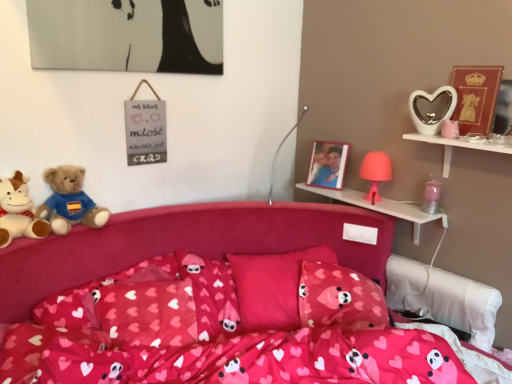
This screenshot has width=512, height=384. What do you see at coordinates (450, 129) in the screenshot?
I see `white glossy heart at upper right, which is the second toy in top-to-bottom order` at bounding box center [450, 129].

The image size is (512, 384). Describe the element at coordinates (455, 146) in the screenshot. I see `white glossy heart-shaped object at upper right, which ranks as the 2th shelf in back-to-front order` at that location.

At what (x,y) coordinates should I click in order to perform the action: click on white glossy heart-shaped object at upper right, marked as the first shelf in a front-to-back arrangement. Please return your answer as a coordinate pair (x, y). Looking at the image, I should click on (455, 146).

At what (x,y) coordinates should I click in order to perform the action: click on matte gold picture frame at upper right, arranged as the 2th picture frame when viewed from the left. Please return your answer as a coordinate pair (x, y). Image resolution: width=512 pixels, height=384 pixels. Looking at the image, I should click on (476, 97).

How much space does pink fabric pillow at center, placed as the first pillow when sorted from right to left, occupy vertically?

18.28 centimeters.

Describe the element at coordinates (328, 164) in the screenshot. Image resolution: width=512 pixels, height=384 pixels. I see `wooden photo frame at upper right, the 2th picture frame viewed from the right` at that location.

Where is `white glossy heart at upper right, the 3th toy ordered from the bottom`? This screenshot has height=384, width=512. white glossy heart at upper right, the 3th toy ordered from the bottom is located at coordinates (450, 129).

Between matte pink lamp at upper right, placed as the third toy when sorted from top to bottom, and silver metallic lamp at center, which one is positioned in front?

silver metallic lamp at center is more forward.

Which of these two, matte pink lamp at upper right, which is counted as the second toy, starting from the bottom, or silver metallic lamp at center, stands shorter?

matte pink lamp at upper right, which is counted as the second toy, starting from the bottom.

From the image's perspective, between matte pink lamp at upper right, placed as the third toy when sorted from top to bottom, and silver metallic lamp at center, who is located below?

matte pink lamp at upper right, placed as the third toy when sorted from top to bottom, appears lower in the image.

Considering the relative positions of matte pink lamp at upper right, which is counted as the second toy, starting from the bottom, and silver metallic lamp at center in the image provided, is matte pink lamp at upper right, which is counted as the second toy, starting from the bottom, to the left or to the right of silver metallic lamp at center?

Based on their positions, matte pink lamp at upper right, which is counted as the second toy, starting from the bottom, is located to the right of silver metallic lamp at center.

Considering the relative sizes of matte gold picture frame at upper right, which is counted as the first picture frame, starting from the front, and soft plush teddy bear at left, which is counted as the second teddy bear, starting from the right, in the image provided, is matte gold picture frame at upper right, which is counted as the first picture frame, starting from the front, wider than soft plush teddy bear at left, which is counted as the second teddy bear, starting from the right,?

No.

Is matte gold picture frame at upper right, which is counted as the first picture frame, starting from the front, turned away from soft plush teddy bear at left, the first teddy bear when ordered from left to right?

No, matte gold picture frame at upper right, which is counted as the first picture frame, starting from the front, is not facing the opposite direction of soft plush teddy bear at left, the first teddy bear when ordered from left to right.

In terms of height, does matte gold picture frame at upper right, arranged as the 2th picture frame when viewed from the left, look taller or shorter compared to soft plush teddy bear at left, the first teddy bear when ordered from left to right?

Considering their sizes, matte gold picture frame at upper right, arranged as the 2th picture frame when viewed from the left, has more height than soft plush teddy bear at left, the first teddy bear when ordered from left to right.

From the picture: Could you tell me if white glossy heart at upper right, the 3th toy ordered from the bottom, is turned towards pink plastic lamp at upper right, the first shelf from the back?

No, white glossy heart at upper right, the 3th toy ordered from the bottom, is not aimed at pink plastic lamp at upper right, the first shelf from the back.

Considering the positions of objects white glossy heart at upper right, the 3th toy ordered from the bottom, and pink plastic lamp at upper right, the first shelf from the back, in the image provided, who is more to the left, white glossy heart at upper right, the 3th toy ordered from the bottom, or pink plastic lamp at upper right, the first shelf from the back,?

Positioned to the left is pink plastic lamp at upper right, the first shelf from the back.

Is white glossy heart at upper right, the 3th toy ordered from the bottom, spatially inside pink plastic lamp at upper right, the second shelf in the front-to-back sequence, or outside of it?

white glossy heart at upper right, the 3th toy ordered from the bottom, is not enclosed by pink plastic lamp at upper right, the second shelf in the front-to-back sequence.

Considering the relative sizes of white glossy heart at upper right, which is the second toy in top-to-bottom order, and pink plastic lamp at upper right, the first shelf from the back, in the image provided, is white glossy heart at upper right, which is the second toy in top-to-bottom order, shorter than pink plastic lamp at upper right, the first shelf from the back,?

Yes, white glossy heart at upper right, which is the second toy in top-to-bottom order, is shorter than pink plastic lamp at upper right, the first shelf from the back.

In the scene shown: What's the angular difference between matte gold picture frame at upper right, arranged as the 2th picture frame when viewed from the left, and pink fabric pillow at center, the 1th pillow viewed from the left,'s facing directions?

67.3 degrees separate the facing orientations of matte gold picture frame at upper right, arranged as the 2th picture frame when viewed from the left, and pink fabric pillow at center, the 1th pillow viewed from the left.

Which object is thinner, matte gold picture frame at upper right, arranged as the 2th picture frame when viewed from the left, or pink fabric pillow at center, which is the second pillow from right to left?

Thinner between the two is matte gold picture frame at upper right, arranged as the 2th picture frame when viewed from the left.

Is matte gold picture frame at upper right, the first picture frame in the right-to-left sequence, to the left or to the right of pink fabric pillow at center, the 1th pillow viewed from the left, in the image?

matte gold picture frame at upper right, the first picture frame in the right-to-left sequence, is to the right of pink fabric pillow at center, the 1th pillow viewed from the left.

Which of these two, pink fabric pillow at center, the 1th pillow viewed from the left, or pink plastic lamp at upper right, the first shelf from the back, is thinner?

Thinner between the two is pink plastic lamp at upper right, the first shelf from the back.

From the image's perspective, is pink fabric pillow at center, the 1th pillow viewed from the left, located beneath pink plastic lamp at upper right, the second shelf in the front-to-back sequence?

Yes, from the image's perspective, pink fabric pillow at center, the 1th pillow viewed from the left, is beneath pink plastic lamp at upper right, the second shelf in the front-to-back sequence.

Is pink fabric pillow at center, the 1th pillow viewed from the left, taller or shorter than pink plastic lamp at upper right, the second shelf in the front-to-back sequence?

pink fabric pillow at center, the 1th pillow viewed from the left, is taller than pink plastic lamp at upper right, the second shelf in the front-to-back sequence.

Considering the sizes of objects brown plush teddy bear at left, positioned as the first teddy bear in right-to-left order, and matte gold picture frame at upper right, which is counted as the first picture frame, starting from the front, in the image provided, who is smaller, brown plush teddy bear at left, positioned as the first teddy bear in right-to-left order, or matte gold picture frame at upper right, which is counted as the first picture frame, starting from the front,?

matte gold picture frame at upper right, which is counted as the first picture frame, starting from the front.

In the scene shown: Can you tell me how much brown plush teddy bear at left, the 2th teddy bear from the left, and matte gold picture frame at upper right, which is counted as the first picture frame, starting from the front, differ in facing direction?

They differ by 89.3 degrees in their facing directions.

Which is behind, brown plush teddy bear at left, positioned as the first teddy bear in right-to-left order, or matte gold picture frame at upper right, which is counted as the first picture frame, starting from the front?

matte gold picture frame at upper right, which is counted as the first picture frame, starting from the front, is more distant.

The image size is (512, 384). What are the coordinates of `picture frame that is the 2nd object above the brown plush teddy bear at left, positioned as the first teddy bear in right-to-left order (from a real-world perspective)` in the screenshot? It's located at (476, 97).

Which object is positioned more to the left, white glossy heart-shaped object at upper right, the first toy when ordered from top to bottom, or brown plush teddy bear at left, positioned as the first teddy bear in right-to-left order?

Positioned to the left is brown plush teddy bear at left, positioned as the first teddy bear in right-to-left order.

Between white glossy heart-shaped object at upper right, the first toy when ordered from top to bottom, and brown plush teddy bear at left, positioned as the first teddy bear in right-to-left order, which one has smaller width?

white glossy heart-shaped object at upper right, the first toy when ordered from top to bottom, is thinner.

Is brown plush teddy bear at left, positioned as the first teddy bear in right-to-left order, completely or partially inside white glossy heart-shaped object at upper right, which is the fourth toy from bottom to top?

Actually, brown plush teddy bear at left, positioned as the first teddy bear in right-to-left order, is outside white glossy heart-shaped object at upper right, which is the fourth toy from bottom to top.

The image size is (512, 384). Find the location of `lamp on the left of matte pink lamp at upper right, which is counted as the second toy, starting from the bottom`. lamp on the left of matte pink lamp at upper right, which is counted as the second toy, starting from the bottom is located at coordinates (278, 152).

Locate an element on the screen. the 2nd teddy bear positioned below the matte gold picture frame at upper right, the first picture frame in the right-to-left sequence (from a real-world perspective) is located at coordinates (18, 211).

Looking at the image, which one is located closer to matte pink lamp at upper right, placed as the third toy when sorted from top to bottom, silver metallic lamp at center or wooden photo frame at upper right, the 2th picture frame viewed from the right?

The object closer to matte pink lamp at upper right, placed as the third toy when sorted from top to bottom, is wooden photo frame at upper right, the 2th picture frame viewed from the right.

Looking at the image, which one is located closer to pink fabric bed at center, brown plush teddy bear at left, the 2th teddy bear from the left, or wooden photo frame at upper right, the first picture frame in the left-to-right sequence?

brown plush teddy bear at left, the 2th teddy bear from the left, lies closer to pink fabric bed at center than the other object.

Considering their positions, is matte gold picture frame at upper right, which is counted as the first picture frame, starting from the front, positioned closer to soft plush teddy bear at left, which is counted as the second teddy bear, starting from the right, than white glossy heart-shaped object at upper right, the first toy when ordered from top to bottom?

white glossy heart-shaped object at upper right, the first toy when ordered from top to bottom, is positioned closer to the anchor soft plush teddy bear at left, which is counted as the second teddy bear, starting from the right.

When comparing their distances from soft plush teddy bear at left, the first teddy bear when ordered from left to right, does pink fabric pillow at center, placed as the first pillow when sorted from right to left, or white glossy heart at upper right, which is the second toy in top-to-bottom order, seem closer?

Based on the image, pink fabric pillow at center, placed as the first pillow when sorted from right to left, appears to be nearer to soft plush teddy bear at left, the first teddy bear when ordered from left to right.

From the image, which object appears to be nearer to brown plush teddy bear at left, positioned as the first teddy bear in right-to-left order, pink fabric pillow at center, the 2th pillow from the left, or silver metallic lamp at center?

Among the two, pink fabric pillow at center, the 2th pillow from the left, is located nearer to brown plush teddy bear at left, positioned as the first teddy bear in right-to-left order.

Which object lies nearer to the anchor point pink fabric bed at center, soft plush teddy bear at left, the first teddy bear when ordered from left to right, or metallic silver jar at upper right, the 4th toy from the top?

The object closer to pink fabric bed at center is soft plush teddy bear at left, the first teddy bear when ordered from left to right.

Looking at the image, which one is located further to pink plastic lamp at upper right, the second shelf in the front-to-back sequence, white glossy heart at upper right, which is the second toy in top-to-bottom order, or matte gold picture frame at upper right, positioned as the second picture frame in back-to-front order?

matte gold picture frame at upper right, positioned as the second picture frame in back-to-front order, lies further to pink plastic lamp at upper right, the second shelf in the front-to-back sequence, than the other object.

When comparing their distances from brown plush teddy bear at left, the 2th teddy bear from the left, does pink fabric pillow at center, the 1th pillow viewed from the left, or pink fabric bed at center seem closer?

pink fabric bed at center is closer to brown plush teddy bear at left, the 2th teddy bear from the left.

Where is `shelf between pink fabric bed at center and pink plastic lamp at upper right, the first shelf from the back, along the z-axis`? This screenshot has height=384, width=512. shelf between pink fabric bed at center and pink plastic lamp at upper right, the first shelf from the back, along the z-axis is located at coordinates click(455, 146).

Locate an element on the screen. This screenshot has height=384, width=512. picture frame between silver metallic lamp at center and pink fabric pillow at center, the 1th pillow viewed from the left, vertically is located at coordinates (328, 164).

You are a GUI agent. You are given a task and a screenshot of the screen. Output one action in this format:
    pyautogui.click(x=<x>, y=<y>)
    Task: Click on the shelf between pink fabric bed at center and pink fabric pillow at center, which is the second pillow from right to left, in the front-back direction
    The height and width of the screenshot is (384, 512).
    Given the screenshot: What is the action you would take?
    [455, 146]

Locate an element on the screen. The image size is (512, 384). picture frame between brown plush teddy bear at left, positioned as the first teddy bear in right-to-left order, and matte gold picture frame at upper right, arranged as the 2th picture frame when viewed from the left is located at coordinates (328, 164).